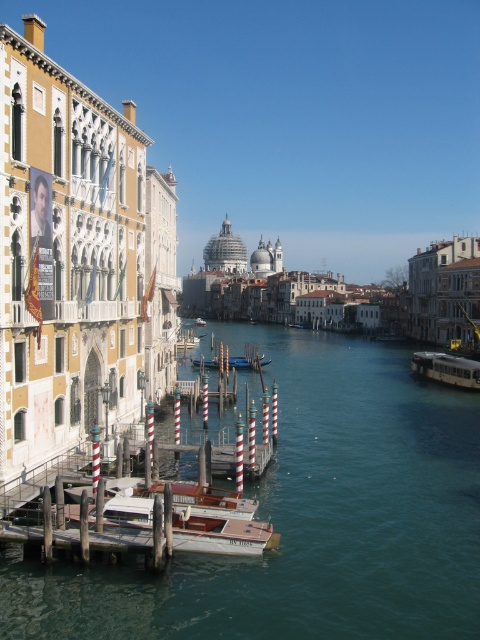
Question: Which object is the closest to the greenish-blue water at center?

Choices:
 (A) wooden polished boat at center
 (B) wooden dock at center
 (C) metallic silver boat at right

Answer: (A)

Question: Can you confirm if greenish-blue water at center is positioned above wooden dock at center?

Choices:
 (A) yes
 (B) no

Answer: (B)

Question: Which of the following is the farthest from the observer?

Choices:
 (A) metallic silver boat at right
 (B) wooden dock at center
 (C) greenish-blue water at center
 (D) wooden polished boat at center

Answer: (B)

Question: Estimate the real-world distances between objects in this image. Which object is closer to the greenish-blue water at center?

Choices:
 (A) wooden dock at center
 (B) wooden polished boat at center
 (C) metallic silver boat at right

Answer: (B)

Question: In this image, where is wooden polished boat at center located relative to wooden gondola at center?

Choices:
 (A) above
 (B) below

Answer: (B)

Question: Does wooden polished boat at center appear over wooden gondola at center?

Choices:
 (A) no
 (B) yes

Answer: (A)